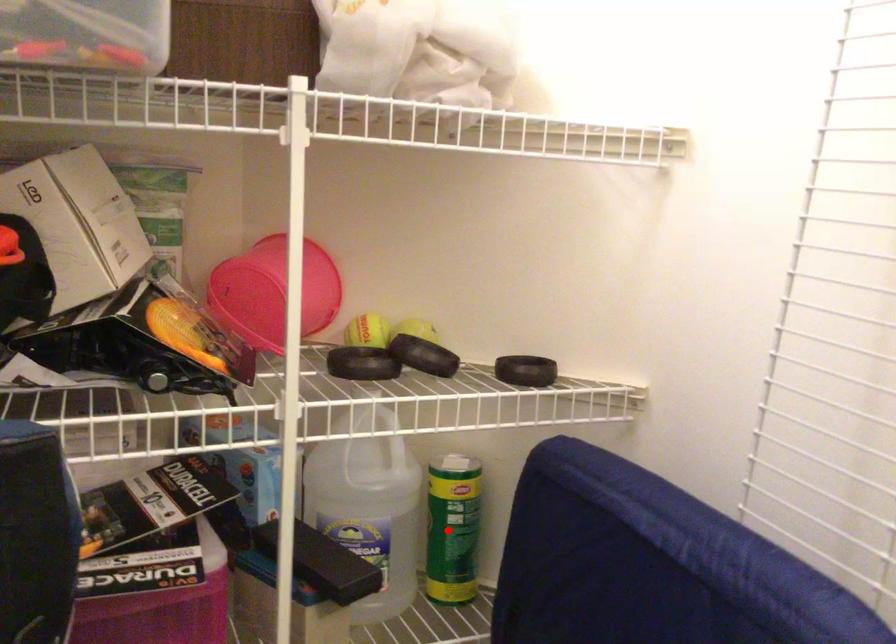
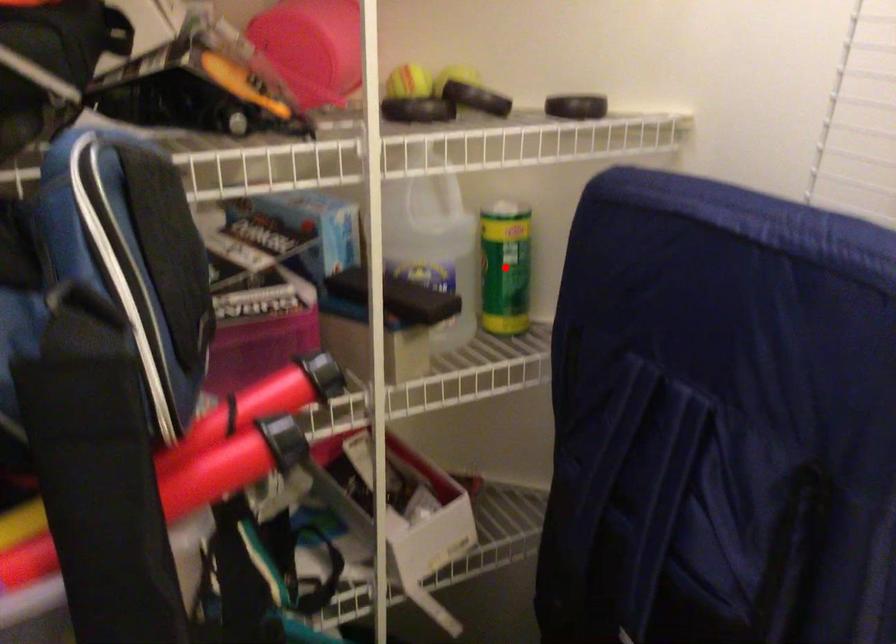
I am providing you with two images of the same scene from different viewpoints. A red point is marked on the first image and another point is marked on the second image. Is the red point in image1 aligned with the point shown in image2?

Yes